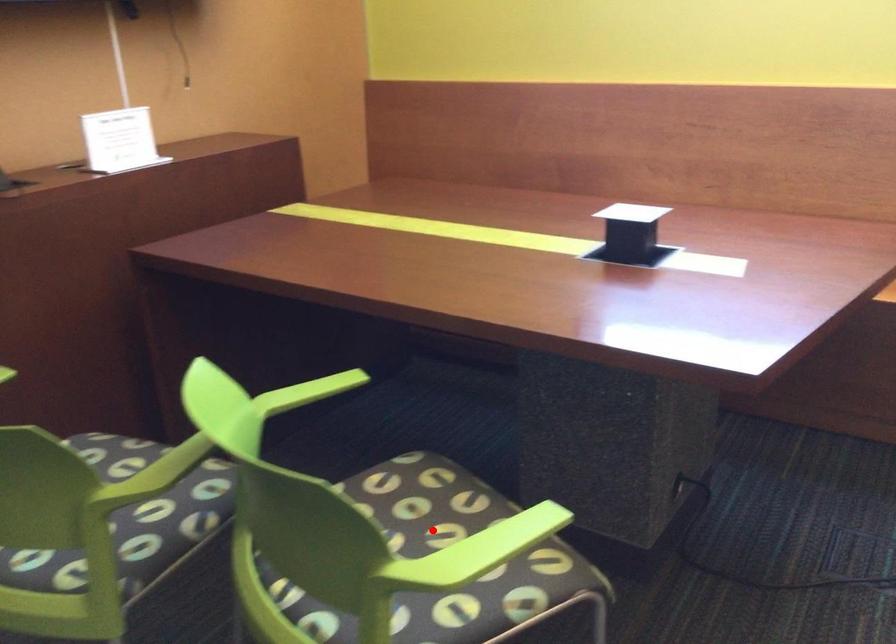
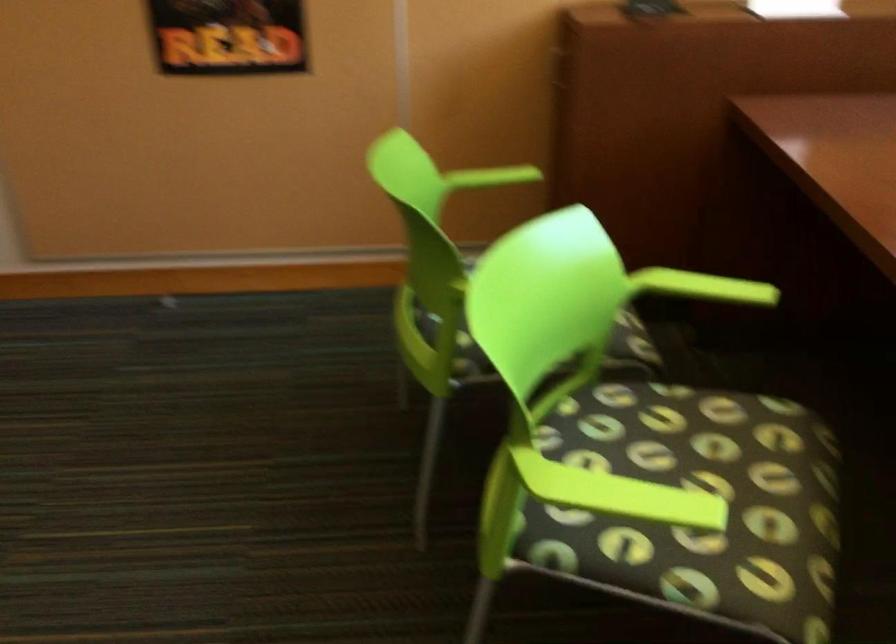
In the second image, find the point that corresponds to the highlighted location in the first image.

(708, 482)